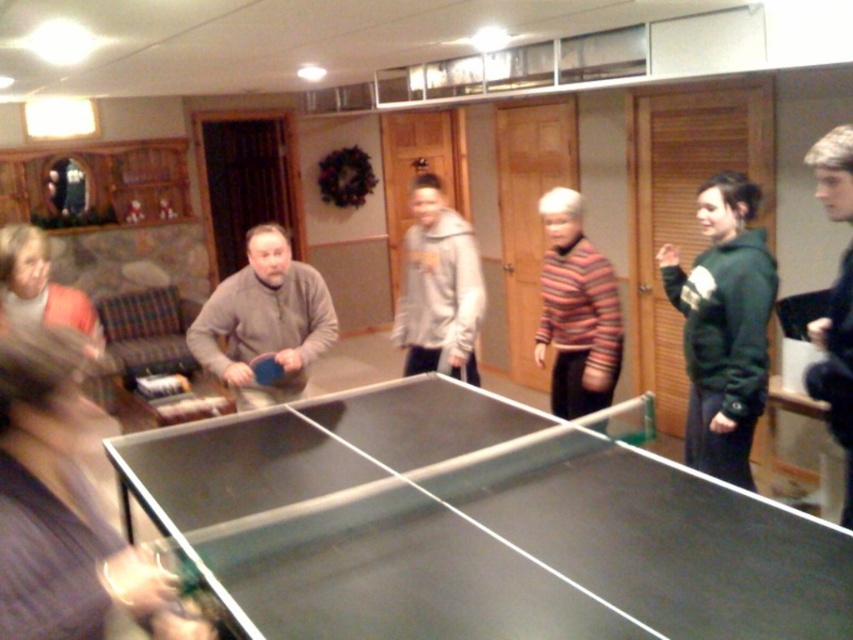
Question: Which of the following is the closest to the observer?

Choices:
 (A) (447, 220)
 (B) (846, 422)
 (C) (781, 552)
 (D) (573, 381)

Answer: (C)

Question: Is smooth black table at center to the left of striped sweater at center from the viewer's perspective?

Choices:
 (A) no
 (B) yes

Answer: (B)

Question: Which point is closer to the camera?

Choices:
 (A) blonde hair at right
 (B) green fleece sweatshirt at right

Answer: (A)

Question: Can you confirm if gray matte ping pong paddle at center is positioned below blonde hair at right?

Choices:
 (A) no
 (B) yes

Answer: (A)

Question: Which of these objects is positioned closest to the gray fleece hoodie at center?

Choices:
 (A) black rubber table tennis table at center
 (B) dark gray fabric shirt at lower left

Answer: (A)

Question: Is green fleece sweatshirt at right bigger than black rubber table tennis table at center?

Choices:
 (A) yes
 (B) no

Answer: (A)